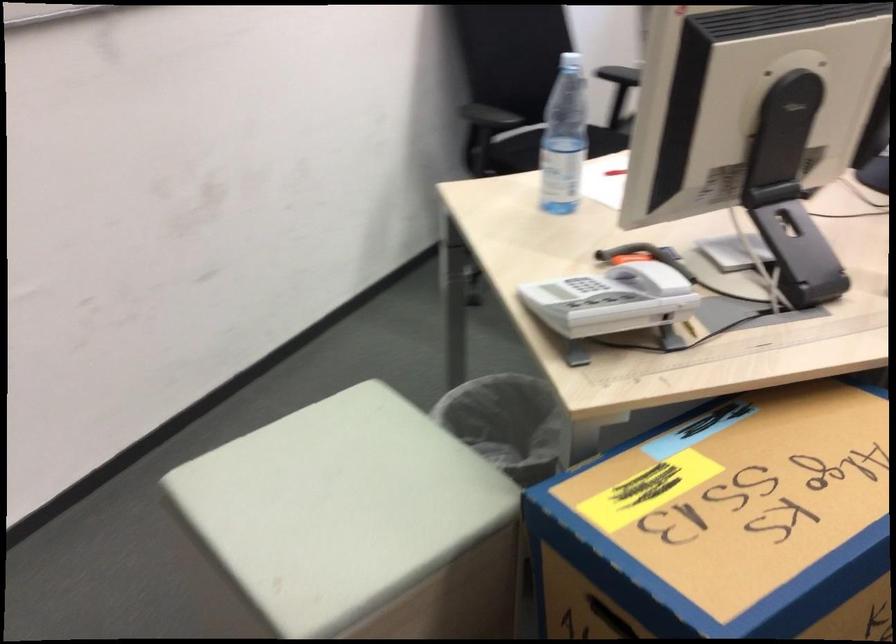
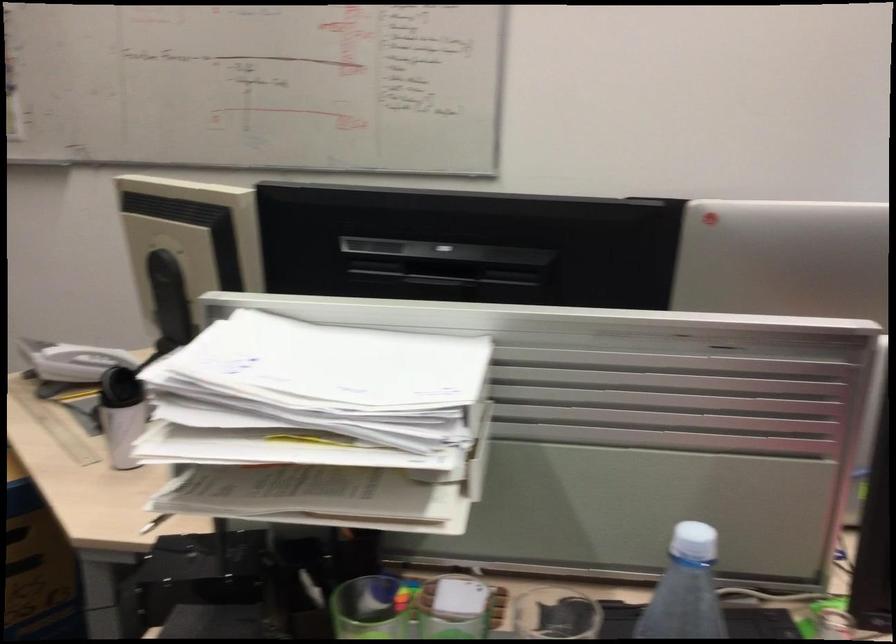
Find the pixel in the second image that matches (x=640, y=292) in the first image.

(82, 362)